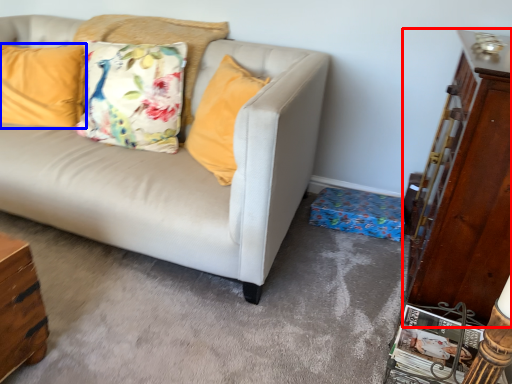
Question: Which point is closer to the camera, dresser (highlighted by a red box) or pillow (highlighted by a blue box)?

Choices:
 (A) dresser
 (B) pillow

Answer: (A)